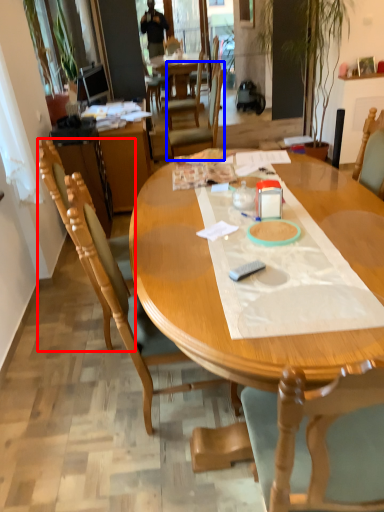
Question: Which point is further to the camera, chair (highlighted by a red box) or chair (highlighted by a blue box)?

Choices:
 (A) chair
 (B) chair

Answer: (B)